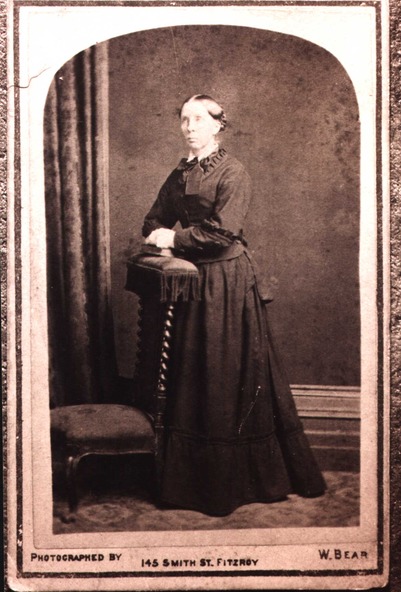
At what (x,y) coordinates should I click in order to perform the action: click on the armrest at top of chair. Please return your answer as a coordinate pair (x, y). The height and width of the screenshot is (592, 401). Looking at the image, I should click on (179, 269).